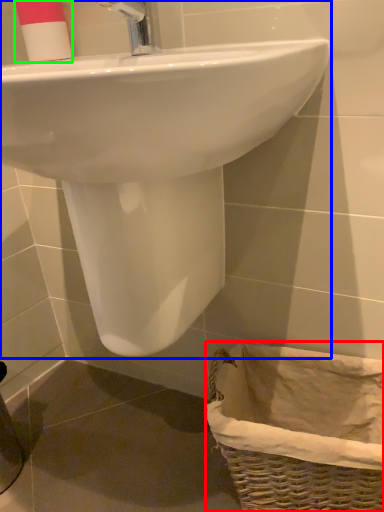
Question: Which object is positioned closest to basket (highlighted by a red box)? Select from sink (highlighted by a blue box) and toiletry (highlighted by a green box).

Choices:
 (A) sink
 (B) toiletry

Answer: (A)